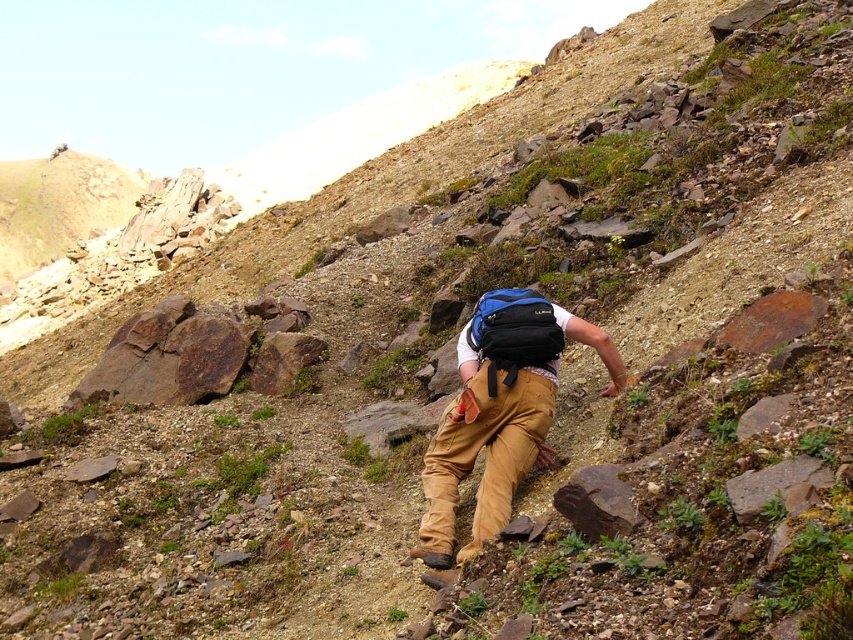
Question: Does khaki pants at center appear over rusty metallic rock at lower center?

Choices:
 (A) no
 (B) yes

Answer: (A)

Question: From the image, what is the correct spatial relationship of khaki pants at center in relation to rusty metallic rock at lower center?

Choices:
 (A) above
 (B) below

Answer: (B)

Question: Among these objects, which one is farthest from the camera?

Choices:
 (A) rusty metallic rock at lower center
 (B) matte black backpack at center
 (C) khaki pants at center
 (D) blue fabric backpack at center

Answer: (D)

Question: Does khaki pants at center come in front of blue fabric backpack at center?

Choices:
 (A) no
 (B) yes

Answer: (B)

Question: Estimate the real-world distances between objects in this image. Which object is closer to the matte black backpack at center?

Choices:
 (A) blue fabric backpack at center
 (B) rusty metallic rock at lower center
 (C) khaki pants at center

Answer: (C)

Question: Which is farther from the blue fabric backpack at center?

Choices:
 (A) khaki pants at center
 (B) rusty metallic rock at lower center
 (C) matte black backpack at center

Answer: (B)